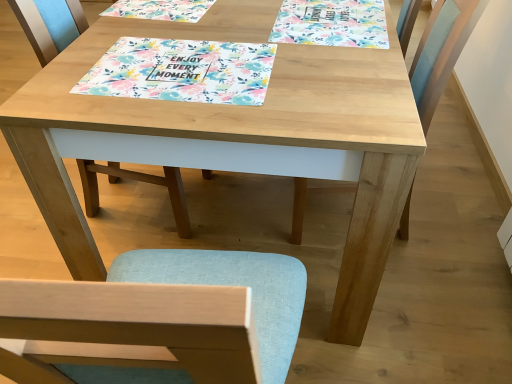
What are the coordinates of `unoccupied region to the right of floral paper placemat at center` in the screenshot? It's located at (330, 68).